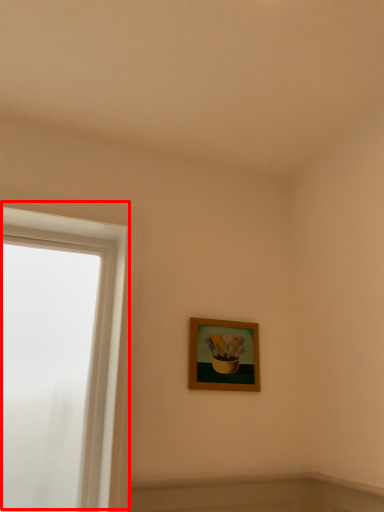
Question: From the image's perspective, what is the correct spatial positioning of window (annotated by the red box) in reference to picture frame?

Choices:
 (A) below
 (B) above

Answer: (B)